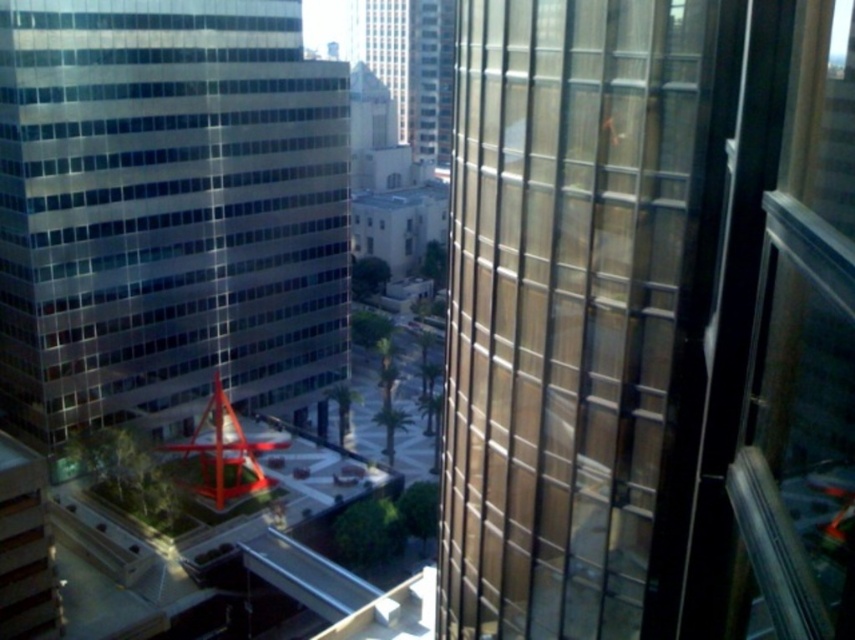
Does transparent glass building at left appear under glassy reflective skyscraper at center?

Indeed, transparent glass building at left is positioned under glassy reflective skyscraper at center.

Between transparent glass building at left and glassy reflective skyscraper at center, which one is positioned lower?

transparent glass building at left is below.

Find the location of a particular element. transparent glass building at left is located at coordinates (167, 212).